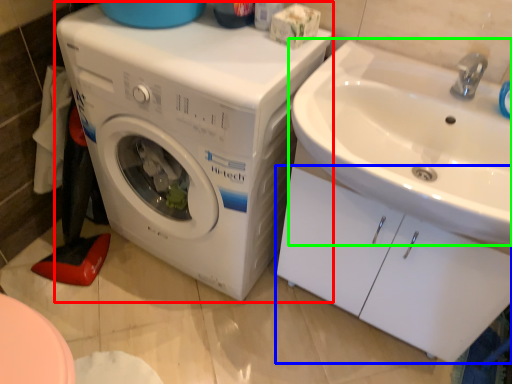
Question: Which object is positioned closest to washing machine (highlighted by a red box)? Select from drawer (highlighted by a blue box) and sink (highlighted by a green box).

Choices:
 (A) drawer
 (B) sink

Answer: (B)